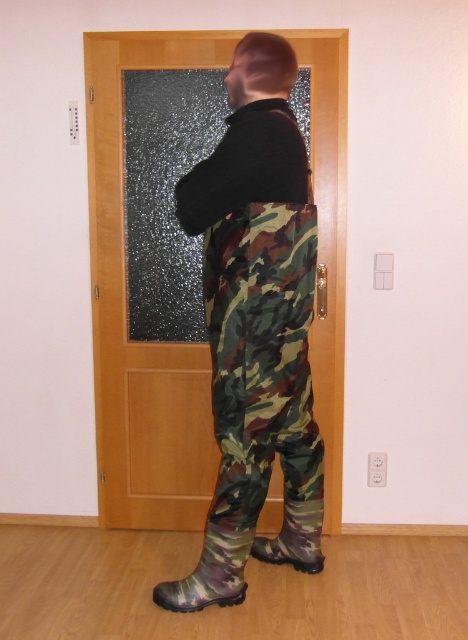
You are a delivery person with a box that is 1.5 meters long. You are standing in front of the wooden door at center. Can you carry the box through the doorway without tilting it sideways?

The wooden door at center is 2.79 meters away from the camera. Since the box is 1.5 meters long, which is shorter than the distance to the door, you can carry the box through the doorway without tilting it sideways.

You are a delivery person trying to enter the house through the wooden door at center. You notice your camouflage rubber boot at lower center is blocking the path. Can you step over it without touching the door?

The wooden door at center is larger in size than camouflage rubber boot at lower center, so yes, you can step over the camouflage rubber boot at lower center without touching the door since it is smaller in size.